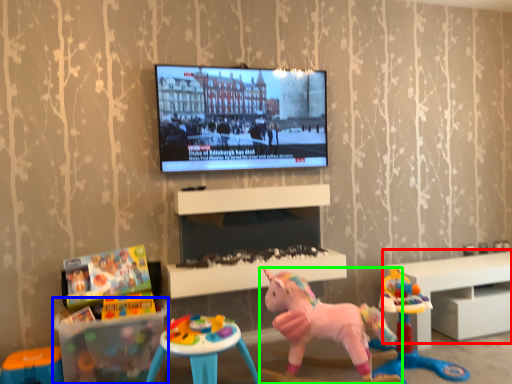
Question: Considering the real-world distances, which object is farthest from furniture (highlighted by a red box)? table (highlighted by a blue box) or toy (highlighted by a green box)?

Choices:
 (A) table
 (B) toy

Answer: (A)